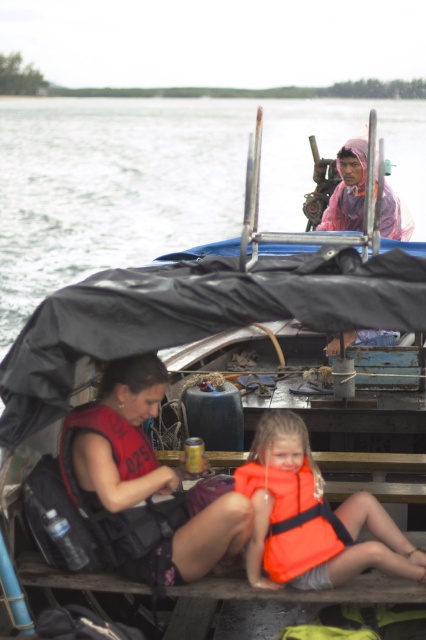
Question: Which point appears farthest from the camera in this image?

Choices:
 (A) (344, 554)
 (B) (152, 365)
 (C) (294, 538)

Answer: (B)

Question: Can you confirm if matte red life vest at lower left is thinner than orange fabric life jacket at center?

Choices:
 (A) no
 (B) yes

Answer: (A)

Question: Does matte red life vest at lower left have a lesser width compared to orange life vest at center?

Choices:
 (A) yes
 (B) no

Answer: (B)

Question: Does orange life vest at center have a lesser width compared to orange fabric life jacket at center?

Choices:
 (A) yes
 (B) no

Answer: (B)

Question: Estimate the real-world distances between objects in this image. Which object is farther from the orange life vest at center?

Choices:
 (A) orange fabric life jacket at center
 (B) matte red life vest at lower left

Answer: (B)

Question: Which point appears farthest from the camera in this image?

Choices:
 (A) (310, 531)
 (B) (190, 538)
 (C) (316, 518)

Answer: (C)